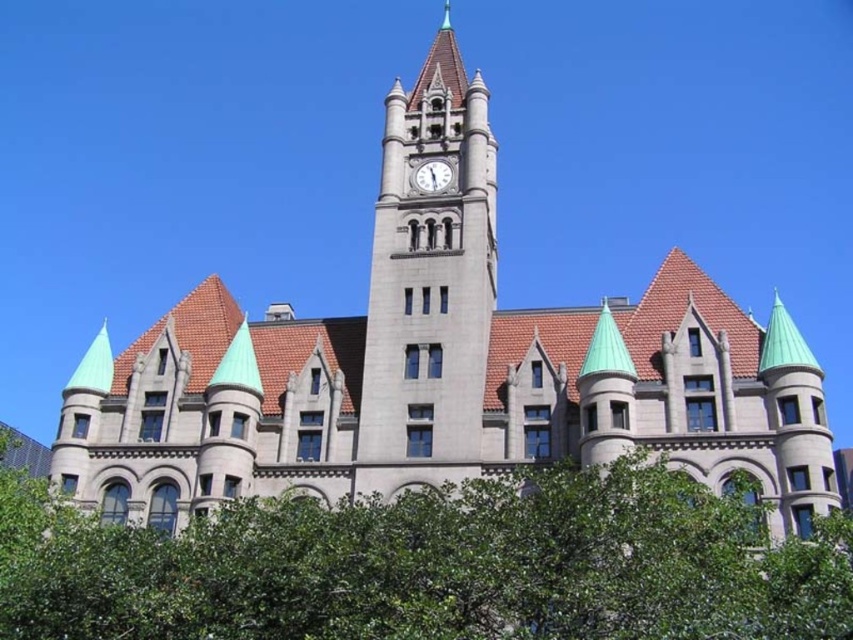
Does green leafy tree at lower center come in front of white stone clock at center?

Yes, green leafy tree at lower center is closer to the viewer.

Is green leafy tree at lower center taller than white stone clock at center?

Yes.

Is point (718, 515) less distant than point (427, 180)?

That is True.

At what (x,y) coordinates should I click in order to perform the action: click on green leafy tree at lower center. Please return your answer as a coordinate pair (x, y). Looking at the image, I should click on (433, 564).

Does stone clock tower at center have a lesser height compared to white stone clock at center?

No, stone clock tower at center is not shorter than white stone clock at center.

Is point (467, 177) farther from camera compared to point (450, 179)?

No, (467, 177) is in front of (450, 179).

Is point (492, 220) closer to camera compared to point (425, 172)?

No, it is not.

In order to click on stone clock tower at center in this screenshot , I will do `click(430, 268)`.

Does green leafy tree at lower center appear over stone clock tower at center?

Incorrect, green leafy tree at lower center is not positioned above stone clock tower at center.

Between green leafy tree at lower center and stone clock tower at center, which one appears on the right side from the viewer's perspective?

From the viewer's perspective, stone clock tower at center appears more on the right side.

Who is more forward, (277,630) or (393,458)?

Point (277,630) is in front.

The height and width of the screenshot is (640, 853). Find the location of `green leafy tree at lower center`. green leafy tree at lower center is located at coordinates (433, 564).